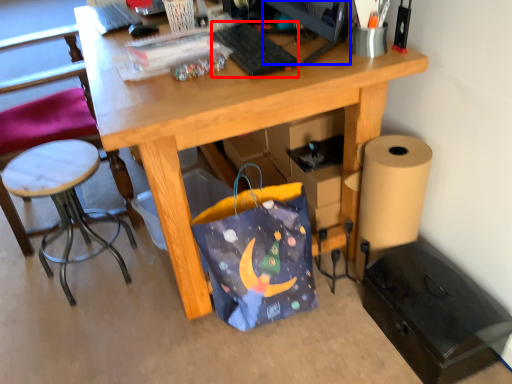
Question: Which object appears closest to the camera in this image, keyboard (highlighted by a red box) or computer monitor (highlighted by a blue box)?

Choices:
 (A) keyboard
 (B) computer monitor

Answer: (B)